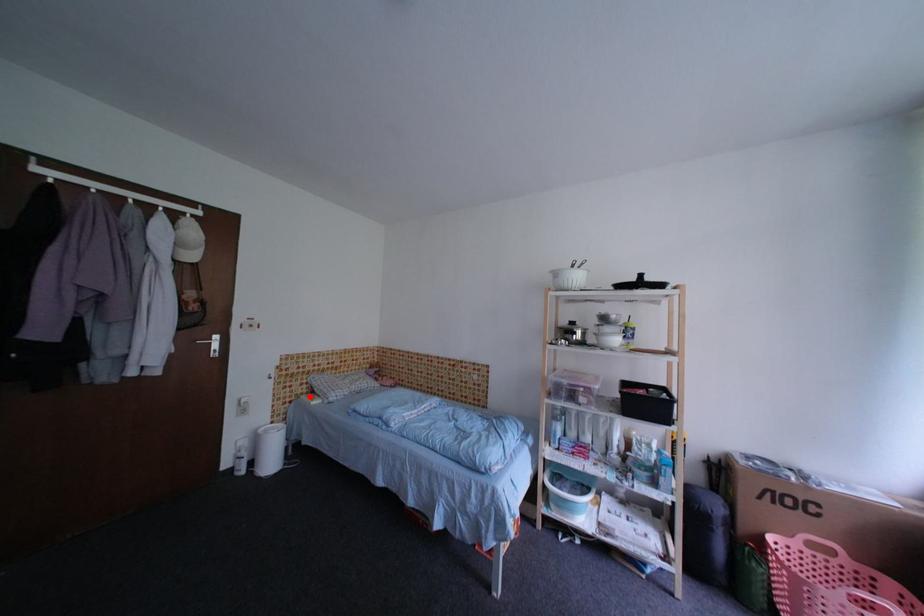
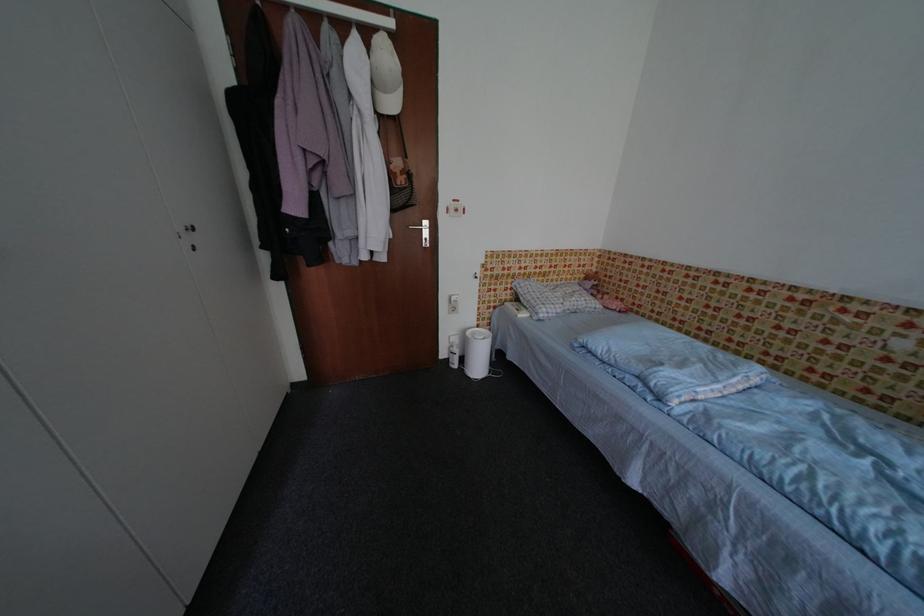
The point at the highlighted location is marked in the first image. Where is the corresponding point in the second image?

(514, 302)